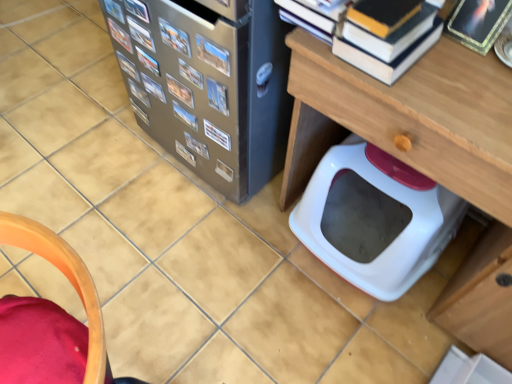
The image size is (512, 384). Identify the location of vacant space in front of metallic black file cabinet at center. (194, 246).